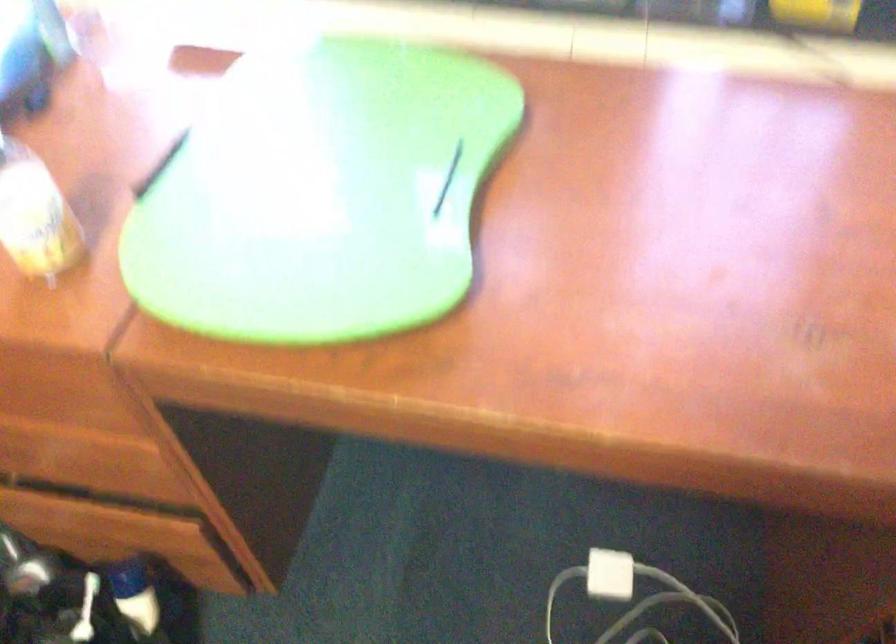
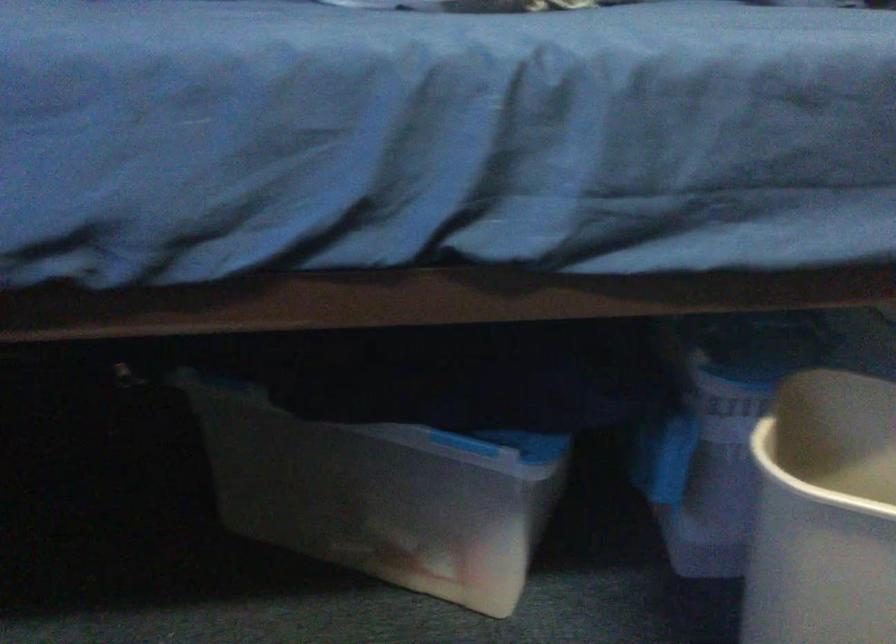
The images are taken continuously from a first-person perspective. In which direction is your viewpoint rotating?

The camera rotated toward right-down.